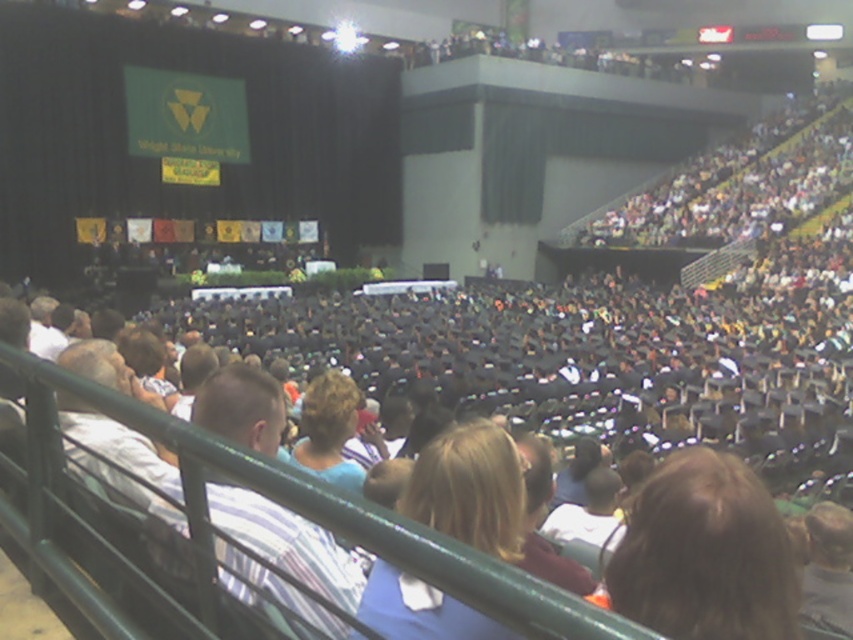
Question: Does blonde hair at lower right appear on the right side of blonde hair at center?

Choices:
 (A) no
 (B) yes

Answer: (B)

Question: Which object is closer to the camera taking this photo?

Choices:
 (A) blonde hair at lower right
 (B) blonde hair at center

Answer: (B)

Question: Which object appears closest to the camera in this image?

Choices:
 (A) blonde hair at lower right
 (B) blonde hair at center

Answer: (B)

Question: Can you confirm if blonde hair at lower right is smaller than blonde hair at center?

Choices:
 (A) yes
 (B) no

Answer: (A)

Question: Is blonde hair at lower right positioned before blonde hair at center?

Choices:
 (A) yes
 (B) no

Answer: (B)